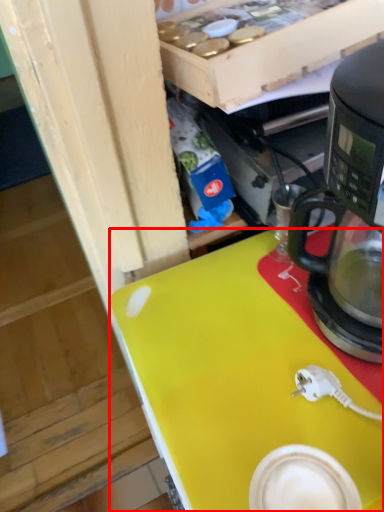
Question: From the image's perspective, what is the correct spatial relationship of desk (annotated by the red box) in relation to coffee maker?

Choices:
 (A) above
 (B) below

Answer: (B)